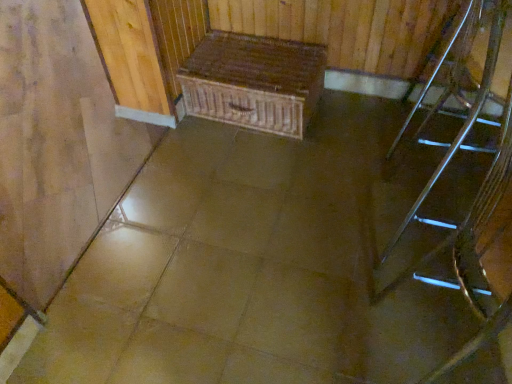
This screenshot has height=384, width=512. What are the coordinates of `blank area to the left of metallic silver stairs at right` in the screenshot? It's located at (331, 238).